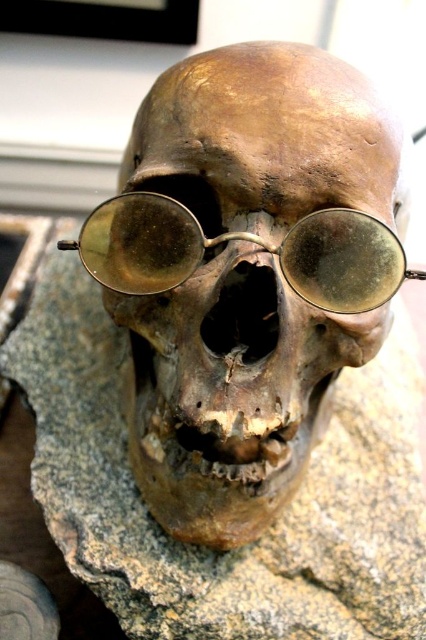
Question: Which point appears closest to the camera in this image?

Choices:
 (A) (316, 273)
 (B) (319, 355)
 (C) (37, 285)

Answer: (A)

Question: Which object is positioned farthest from the brown rough stone at center?

Choices:
 (A) gold reflective glasses at center
 (B) brown matte skull at center

Answer: (A)

Question: Can you confirm if brown matte skull at center is positioned below brown rough stone at center?

Choices:
 (A) yes
 (B) no

Answer: (B)

Question: Does brown matte skull at center have a lesser width compared to brown rough stone at center?

Choices:
 (A) no
 (B) yes

Answer: (B)

Question: Which point is farther to the camera?

Choices:
 (A) click(126, 160)
 (B) click(167, 572)
 (C) click(365, 221)

Answer: (A)

Question: Is brown matte skull at center below gold reflective glasses at center?

Choices:
 (A) no
 (B) yes

Answer: (B)